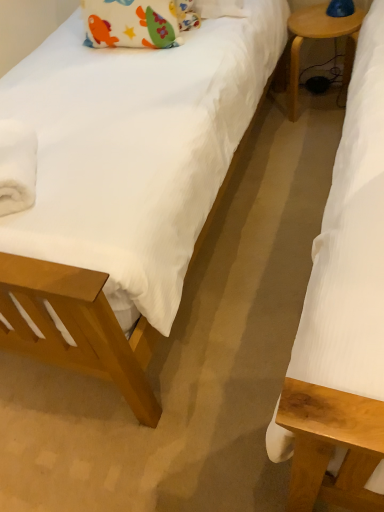
Question: Is wooden side table at right completely or partially outside of white fluffy towel at left?

Choices:
 (A) no
 (B) yes

Answer: (B)

Question: Is wooden side table at right further to camera compared to white fluffy towel at left?

Choices:
 (A) yes
 (B) no

Answer: (A)

Question: From a real-world perspective, is wooden side table at right under white fluffy towel at left?

Choices:
 (A) no
 (B) yes

Answer: (B)

Question: Can you confirm if wooden side table at right is positioned to the left of white fluffy towel at left?

Choices:
 (A) yes
 (B) no

Answer: (B)

Question: Is wooden side table at right far from white fluffy towel at left?

Choices:
 (A) no
 (B) yes

Answer: (B)

Question: From the image's perspective, is wooden side table at right on top of white fluffy towel at left?

Choices:
 (A) no
 (B) yes

Answer: (B)

Question: Is wooden side table at right further to the viewer compared to soft cotton pillow at upper left?

Choices:
 (A) yes
 (B) no

Answer: (A)

Question: From a real-world perspective, is wooden side table at right on soft cotton pillow at upper left?

Choices:
 (A) no
 (B) yes

Answer: (A)

Question: Can you see wooden side table at right touching soft cotton pillow at upper left?

Choices:
 (A) no
 (B) yes

Answer: (A)

Question: From the image's perspective, does wooden side table at right appear lower than soft cotton pillow at upper left?

Choices:
 (A) no
 (B) yes

Answer: (A)

Question: Is wooden side table at right completely or partially outside of soft cotton pillow at upper left?

Choices:
 (A) yes
 (B) no

Answer: (A)

Question: Does wooden side table at right have a larger size compared to soft cotton pillow at upper left?

Choices:
 (A) yes
 (B) no

Answer: (A)

Question: From the image's perspective, is soft cotton pillow at upper left located above wooden side table at right?

Choices:
 (A) no
 (B) yes

Answer: (A)